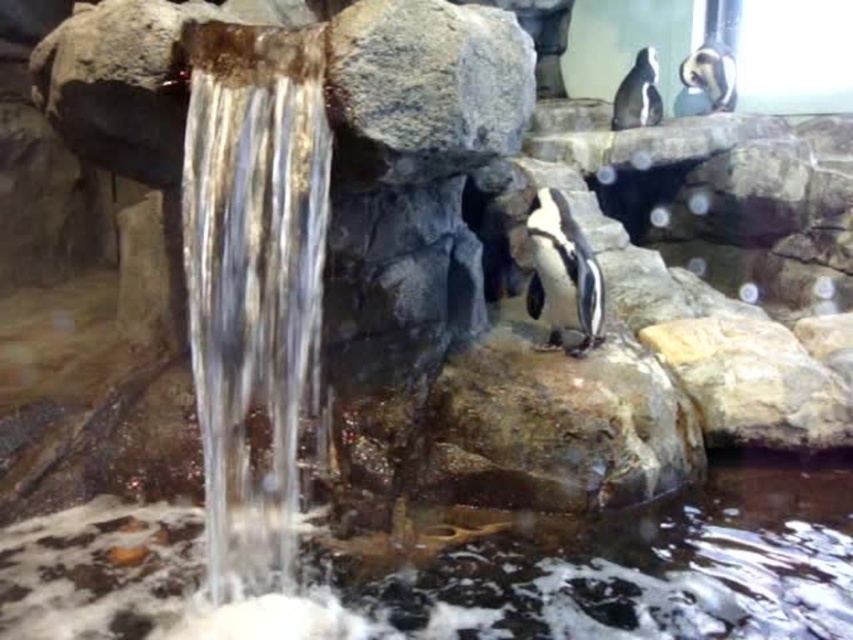
Question: Which is nearer to the black glossy penguin at upper right?

Choices:
 (A) black and white feathers at center
 (B) black and white penguin at upper right
 (C) clear water at center

Answer: (B)

Question: Does black and white feathers at center have a larger size compared to black glossy penguin at upper right?

Choices:
 (A) no
 (B) yes

Answer: (B)

Question: Which object appears closest to the camera in this image?

Choices:
 (A) black glossy penguin at upper right
 (B) black and white penguin at upper right

Answer: (B)

Question: Is black and white feathers at center wider than black glossy penguin at upper right?

Choices:
 (A) yes
 (B) no

Answer: (B)

Question: Is clear water at center bigger than black glossy penguin at upper right?

Choices:
 (A) no
 (B) yes

Answer: (B)

Question: Which point is farther from the camera taking this photo?

Choices:
 (A) (680, 70)
 (B) (619, 115)
 (C) (548, 198)

Answer: (A)